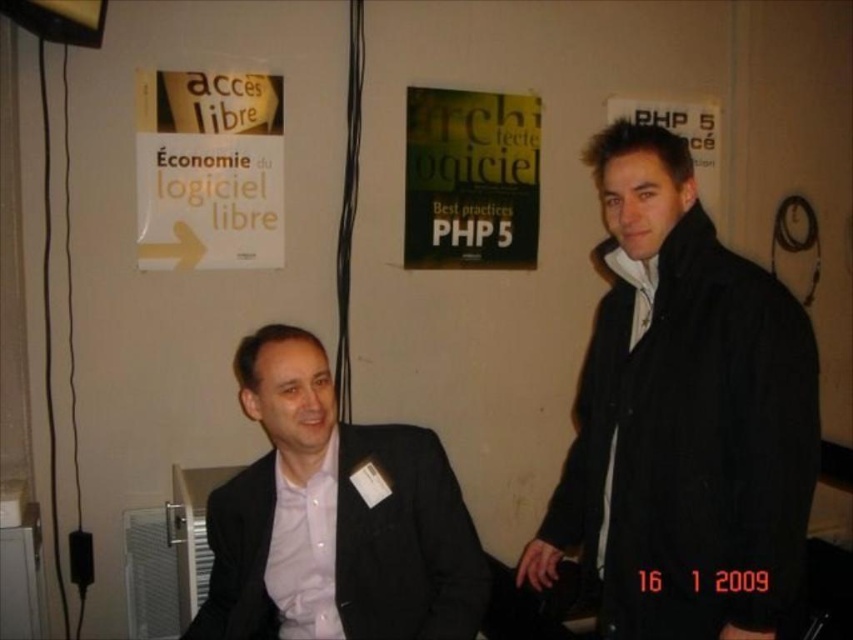
You are organizing a conference and need to ensure that the white paper poster at upper left and the green matte book at center are visible to attendees. Based on their positions, which object is closer to the floor?

The white paper poster at upper left is closer to the floor because it is positioned below the green matte book at center.

You are standing at the origin point in the image. Which direction should you move to reach the black matte suit at left?

Since the black matte suit at left is located at coordinates point 0.811 on the x axis and 0.393 on the y axis, you should move to the right and slightly forward to reach it.